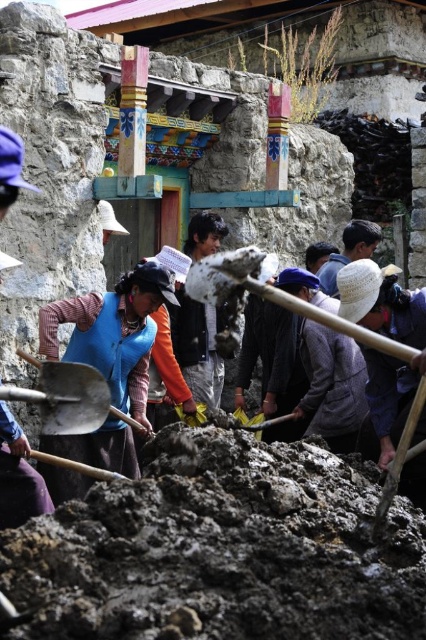
You are a worker in the scene and need to locate your blue fabric vest at center and smooth wooden shovel at center. Based on their positions, which object is closer to the left edge of the image?

The blue fabric vest at center is closer to the left edge of the image because it is positioned to the left of the smooth wooden shovel at center.

You are a worker in the construction site. You need to pick up a shovel from the center area. Which shovel is easier to reach? The smooth wooden shovel at center or the metallic silver shovel at center?

The smooth wooden shovel at center is above the metallic silver shovel at center, so the metallic silver shovel at center is easier to reach since it is lower and closer to the ground.